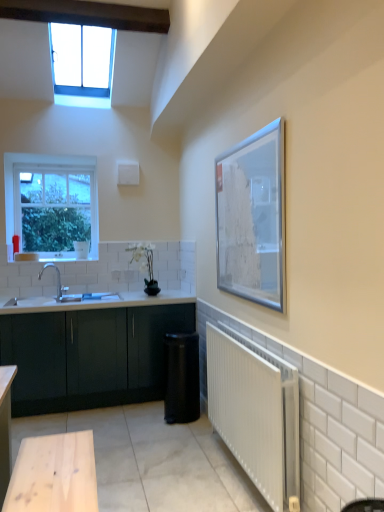
Question: Is silver metallic picture frame at upper right bigger or smaller than matte dark green cabinet at lower left?

Choices:
 (A) small
 (B) big

Answer: (A)

Question: From a real-world perspective, relative to matte dark green cabinet at lower left, is silver metallic picture frame at upper right vertically above or below?

Choices:
 (A) below
 (B) above

Answer: (B)

Question: Estimate the real-world distances between objects in this image. Which object is closer to the matte dark green cabinet at lower left?

Choices:
 (A) black matte water heater at lower right
 (B) clear glass window at upper left, the 1th window when ordered from front to back
 (C) white glossy sink at lower left
 (D) white metallic radiator at lower right
 (E) clear glass window at upper left, which is the second window in top-to-bottom order

Answer: (C)

Question: Based on their relative distances, which object is nearer to the matte dark green cabinet at lower left?

Choices:
 (A) silver metallic picture frame at upper right
 (B) clear glass window at upper left, the 1th window in the top-to-bottom sequence
 (C) white glossy sink at lower left
 (D) black matte water heater at lower right
 (E) white metallic radiator at lower right

Answer: (C)